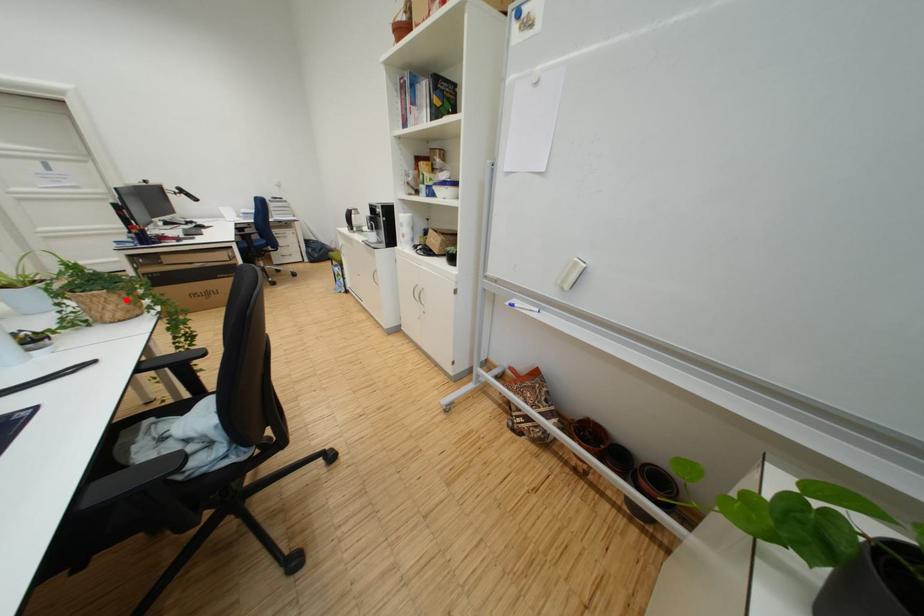
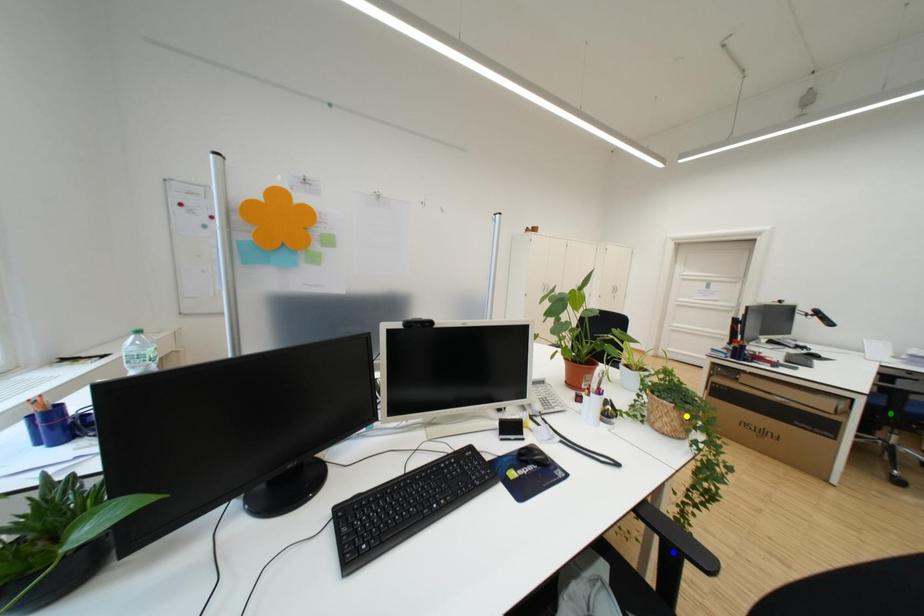
Question: I am providing you with two images of the same scene from different viewpoints. A red point is marked on the first image. You are given multiple points on the second image. Which point in image 2 represents the same 3d spot as the red point in image 1?

Choices:
 (A) yellow point
 (B) green point
 (C) blue point

Answer: (A)